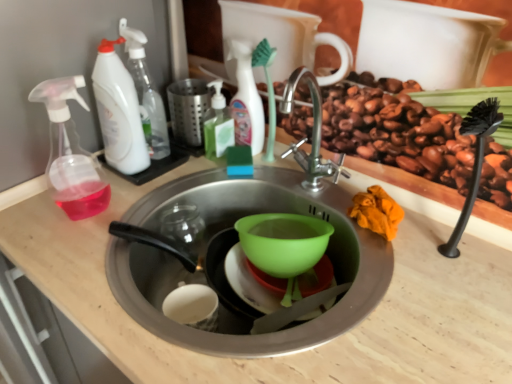
Find the location of `vacant space in front of white plastic spray bottle at upper left, the second cleaning product positioned from the left`. vacant space in front of white plastic spray bottle at upper left, the second cleaning product positioned from the left is located at coordinates (143, 185).